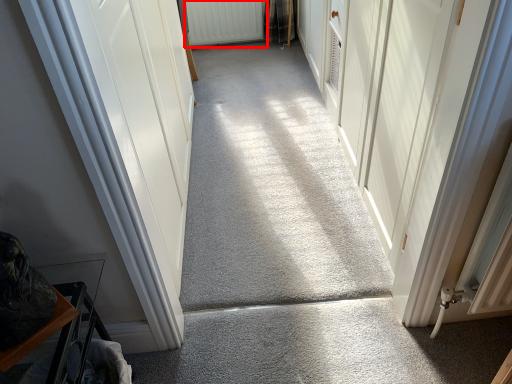
Question: From the image's perspective, where is radiator (annotated by the red box) located relative to concrete?

Choices:
 (A) below
 (B) above

Answer: (B)